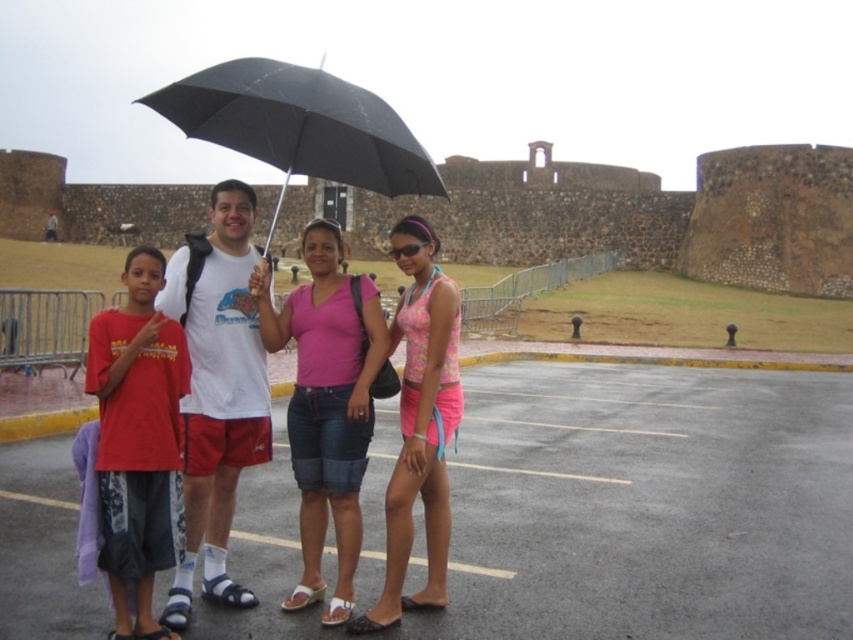
From the picture: Is gray asphalt parking lot at center smaller than pink fabric shorts at lower left?

No, gray asphalt parking lot at center is not smaller than pink fabric shorts at lower left.

Can you confirm if gray asphalt parking lot at center is positioned above pink fabric shorts at lower left?

No, gray asphalt parking lot at center is not above pink fabric shorts at lower left.

I want to click on gray asphalt parking lot at center, so click(648, 506).

Which is more to the left, white matte t-shirt at center or pink fabric shirt at center?

Positioned to the left is white matte t-shirt at center.

Can you confirm if white matte t-shirt at center is positioned to the left of pink fabric shirt at center?

Yes, white matte t-shirt at center is to the left of pink fabric shirt at center.

Is point (212, 577) positioned before point (309, 289)?

Yes, point (212, 577) is in front of point (309, 289).

You are a GUI agent. You are given a task and a screenshot of the screen. Output one action in this format:
    pyautogui.click(x=<x>, y=<y>)
    Task: Click on the white matte t-shirt at center
    
    Given the screenshot: What is the action you would take?
    pyautogui.click(x=218, y=390)

Can you confirm if pink fabric shirt at center is shorter than pink fabric shorts at lower left?

No.

Is point (363, 397) in front of point (136, 458)?

No, (363, 397) is further to viewer.

You are a GUI agent. You are given a task and a screenshot of the screen. Output one action in this format:
    pyautogui.click(x=<x>, y=<y>)
    Task: Click on the pink fabric shirt at center
    The width and height of the screenshot is (853, 640).
    Given the screenshot: What is the action you would take?
    pyautogui.click(x=326, y=404)